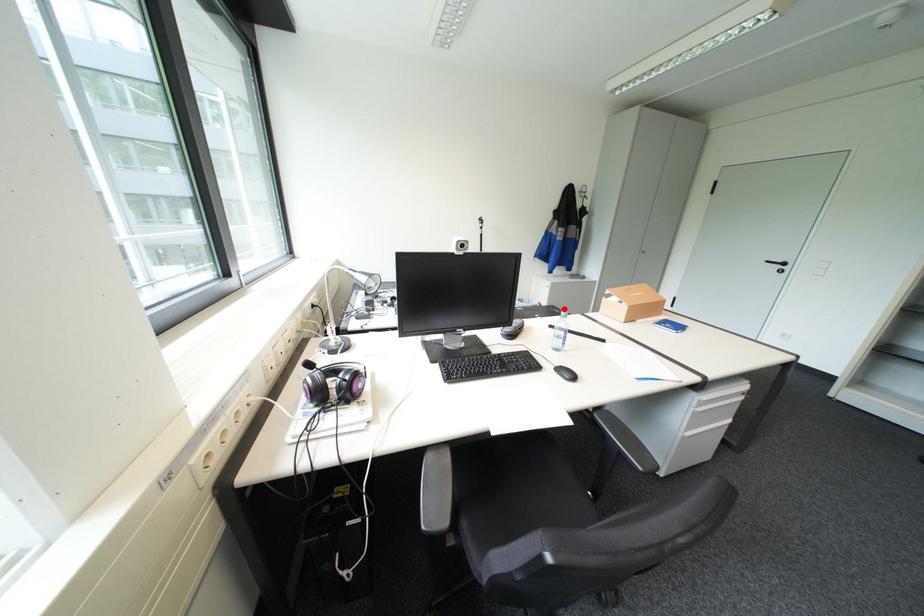
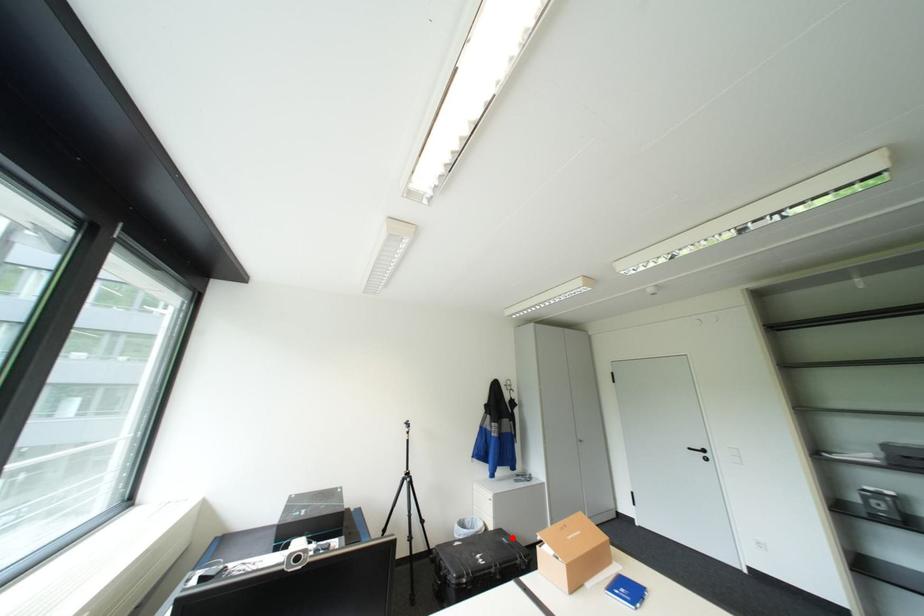
I am providing you with two images of the same scene from different viewpoints. A red point is marked on the first image and another point is marked on the second image. Do the highlighted points in image1 and image2 indicate the same real-world spot?

Yes